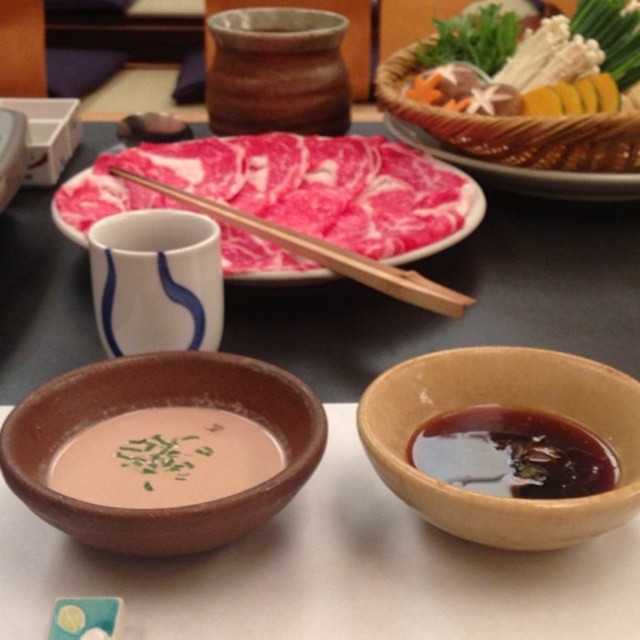
Question: Is brown clay bowl at lower left bigger than matte brown bowl at center?

Choices:
 (A) no
 (B) yes

Answer: (B)

Question: Can you confirm if brown matte bowl at lower right is positioned below dark brown glossy bowl at lower right?

Choices:
 (A) no
 (B) yes

Answer: (A)

Question: Does matte brown bowl at center come in front of smooth wooden platter at center?

Choices:
 (A) yes
 (B) no

Answer: (A)

Question: Which point is farther from the camera taking this photo?

Choices:
 (A) (196, 208)
 (B) (596, 196)
 (C) (20, 420)

Answer: (B)

Question: Among these points, which one is farthest from the camera?

Choices:
 (A) (531, 86)
 (B) (497, 433)
 (C) (376, 273)

Answer: (A)

Question: Estimate the real-world distances between objects in this image. Which object is closer to the smooth wooden platter at center?

Choices:
 (A) smooth wooden skewers at upper right
 (B) brown clay bowl at lower left

Answer: (A)